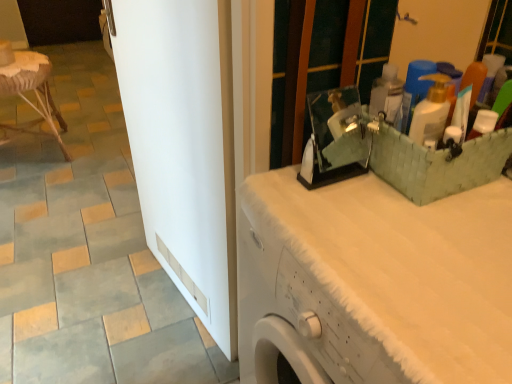
Locate an element on the screen. The height and width of the screenshot is (384, 512). empty space that is ontop of gray matte tile at lower left (from a real-world perspective) is located at coordinates (66, 339).